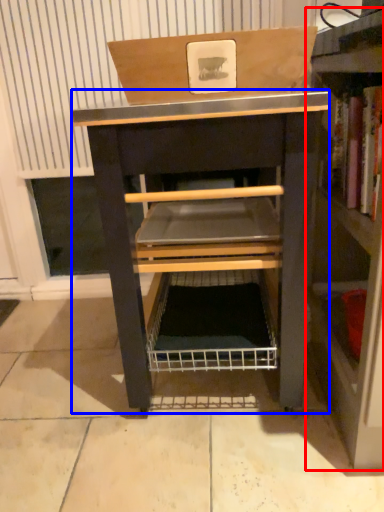
Question: Which of the following is the farthest to the observer, shelf (highlighted by a red box) or vanity (highlighted by a blue box)?

Choices:
 (A) shelf
 (B) vanity

Answer: (B)